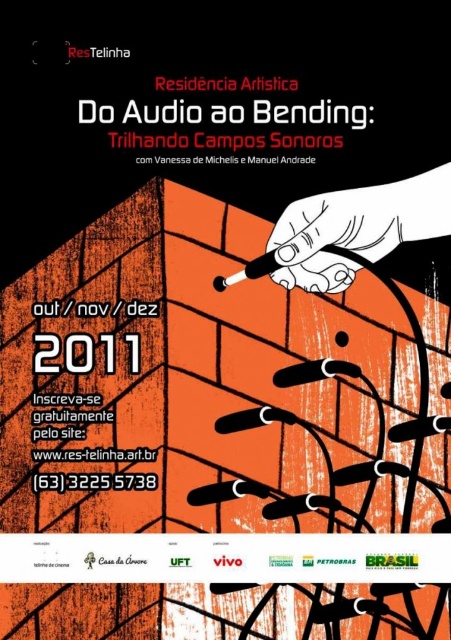
This screenshot has height=640, width=451. Describe the element at coordinates (334, 236) in the screenshot. I see `white matte pencil at center` at that location.

Can you confirm if white matte pencil at center is taller than white paper at center?

Correct, white matte pencil at center is much taller as white paper at center.

Who is more forward, [354,252] or [314,161]?

Positioned in front is point [314,161].

The width and height of the screenshot is (451, 640). I want to click on white matte pencil at center, so click(334, 236).